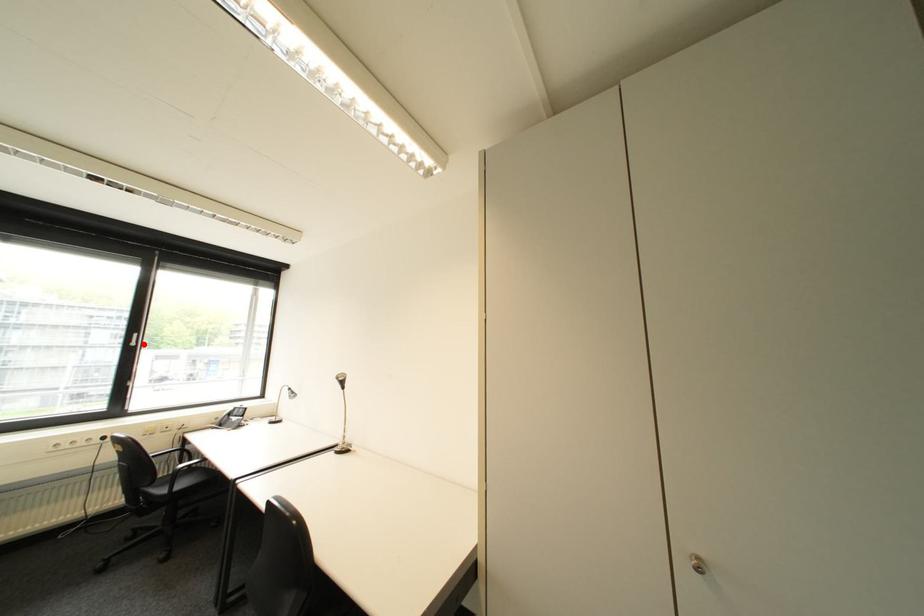
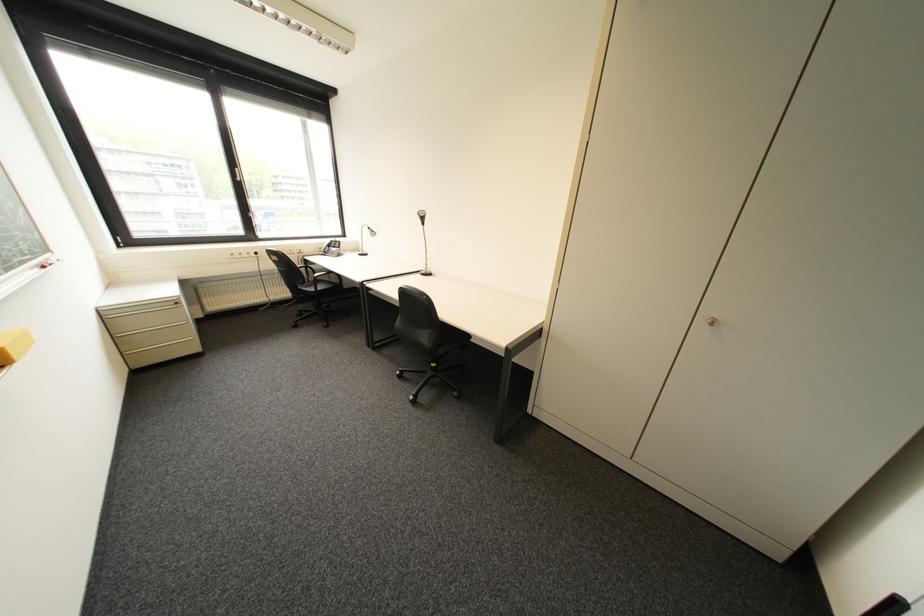
Question: A red point is marked in image1. In image2, is the corresponding 3D point closer to the camera or farther? Reply with the corresponding letter.

Choices:
 (A) The corresponding 3D point is closer.
 (B) The corresponding 3D point is farther.

Answer: (A)